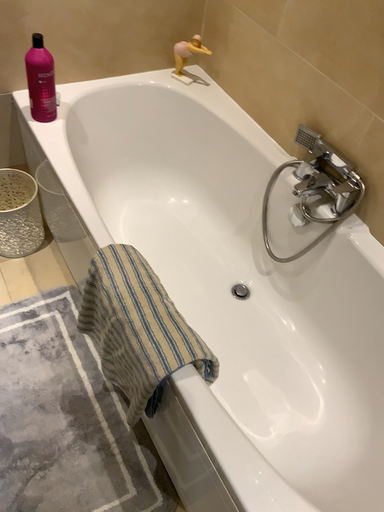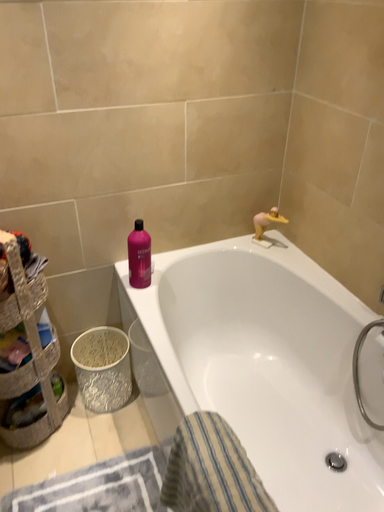
Question: Which way did the camera rotate in the video?

Choices:
 (A) rotated left
 (B) rotated right

Answer: (A)